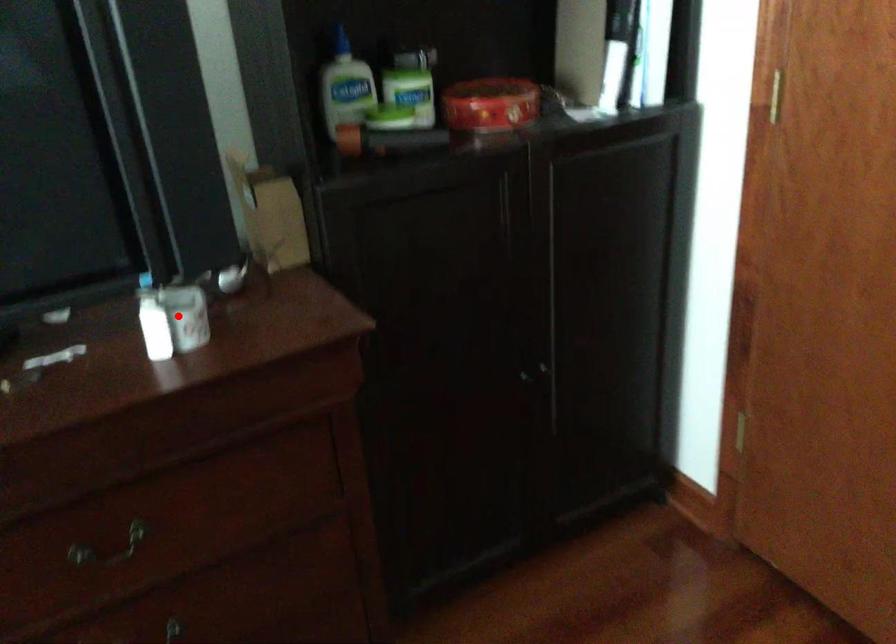
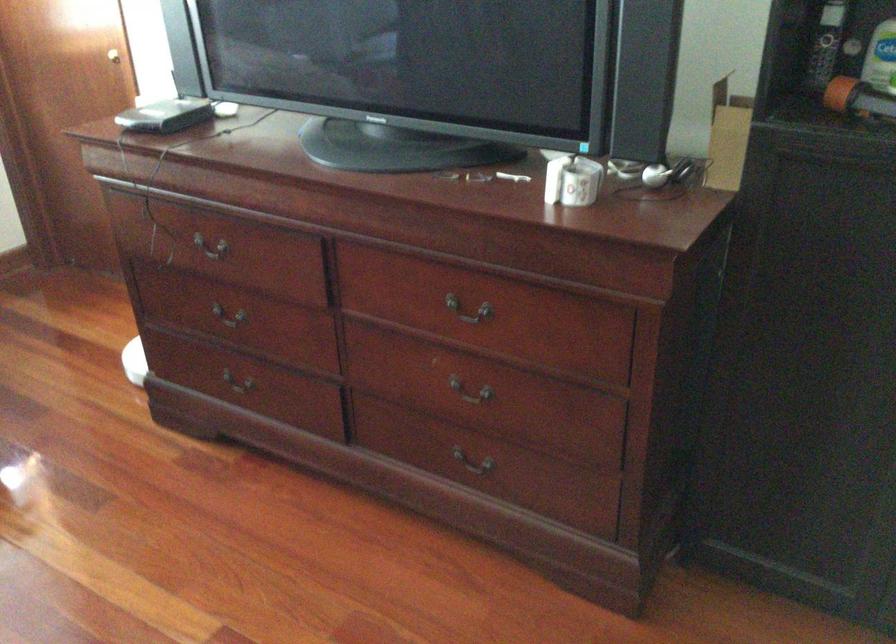
Locate, in the second image, the point that corresponds to the highlighted location in the first image.

(572, 180)